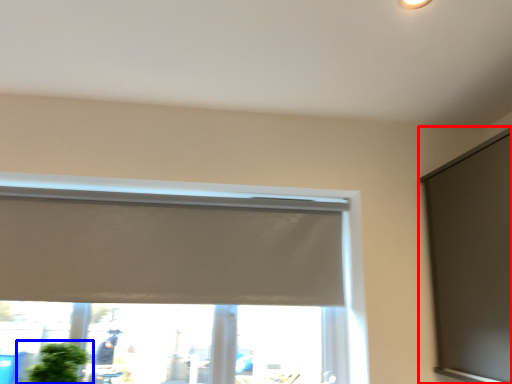
Question: Which point is closer to the camera, window screen (highlighted by a red box) or houseplant (highlighted by a blue box)?

Choices:
 (A) window screen
 (B) houseplant

Answer: (A)